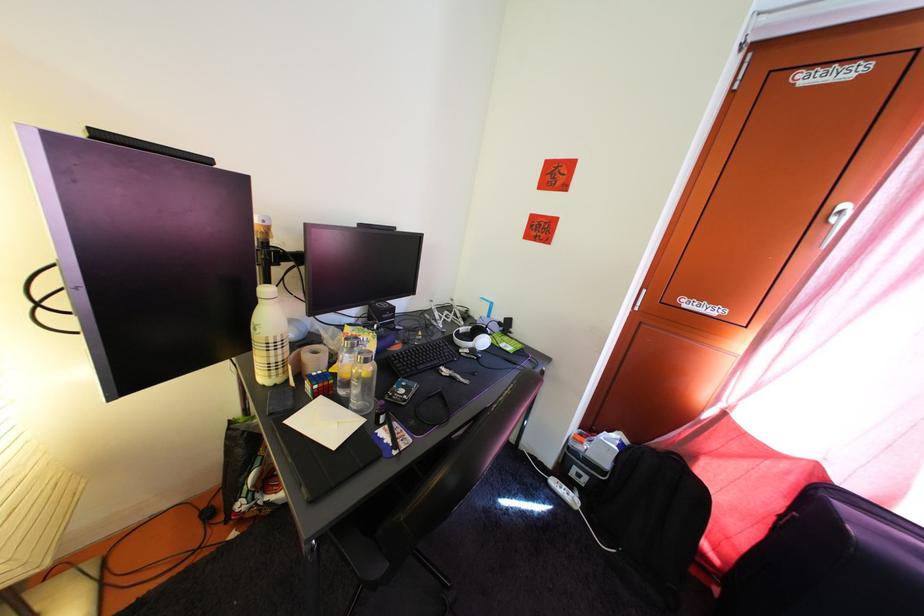
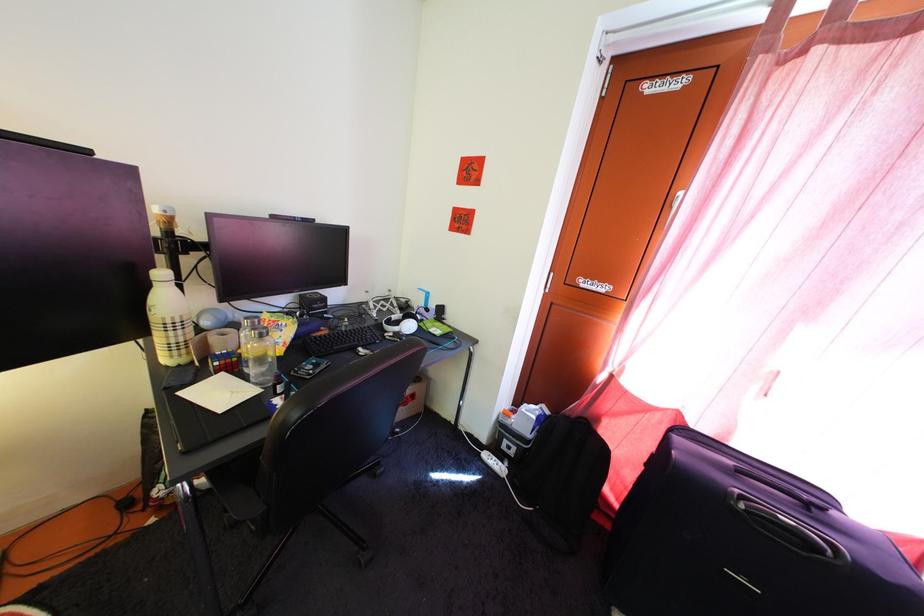
Find the pixel in the second image that matches point (324, 395) in the first image.

(225, 371)